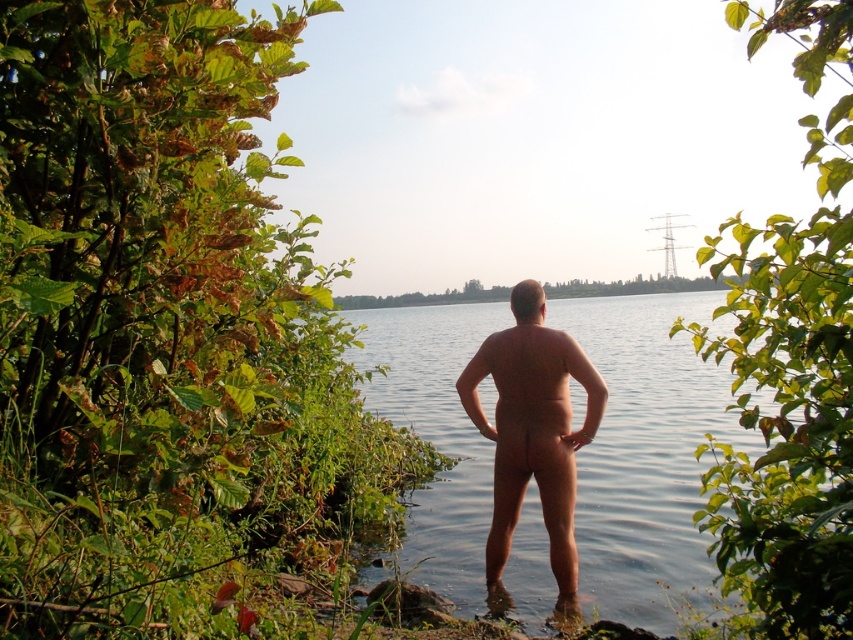
Does clear water at center lie in front of skinny naked man at center?

That is True.

Looking at this image, does clear water at center appear over skinny naked man at center?

Yes.

The width and height of the screenshot is (853, 640). Find the location of `clear water at center`. clear water at center is located at coordinates (648, 452).

Which is above, green leafy shrubs at left or skinny naked man at center?

Positioned higher is skinny naked man at center.

Does green leafy shrubs at left appear over skinny naked man at center?

Actually, green leafy shrubs at left is below skinny naked man at center.

Between point (21, 371) and point (590, 404), which one is positioned in front?

Point (21, 371) is more forward.

Image resolution: width=853 pixels, height=640 pixels. I want to click on green leafy shrubs at left, so click(166, 332).

Measure the distance from green leafy shrubs at left to green leafy shrub at upper right.

green leafy shrubs at left and green leafy shrub at upper right are 8.40 feet apart.

Does green leafy shrubs at left have a lesser width compared to green leafy shrub at upper right?

No.

Does point (51, 241) come farther from viewer compared to point (726, 16)?

That is False.

This screenshot has height=640, width=853. What are the coordinates of `green leafy shrubs at left` in the screenshot? It's located at (166, 332).